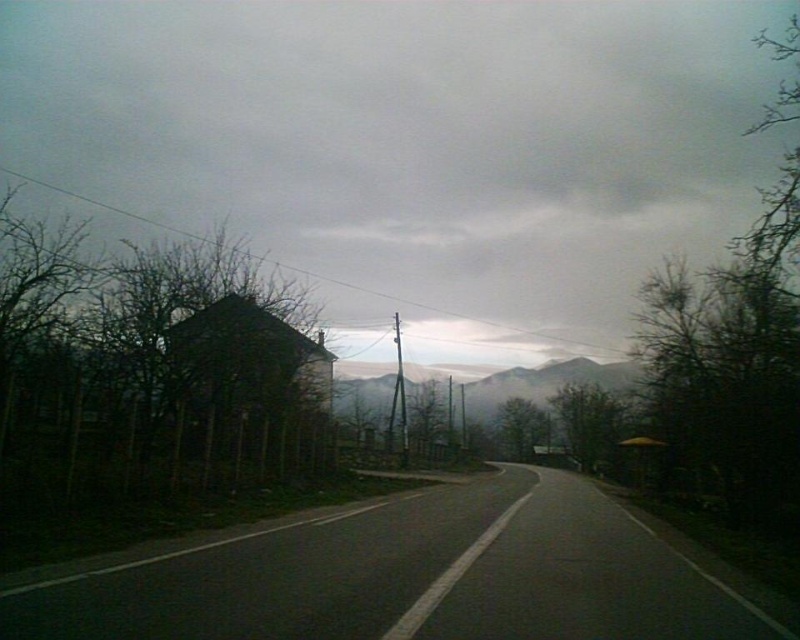
You are a hiker who wants to take a photo of the dark brown wooden hut at center and the foggy misty mountains at center. Which one is closer to you in the scene?

The dark brown wooden hut at center is closer to you because it is positioned in front of the foggy misty mountains at center.

Looking at this image, you are standing at the starting point of the road and want to reach the dark brown wooden hut at center. Which direction should you head towards?

You should head towards the center of the road to reach the dark brown wooden hut at center, as it is located at point (252, 390).

You are driving along the black asphalt road at center and want to take a photo of the foggy misty mountains at center. Since the mountains are in the background, where should you position your camera relative to the road to capture them clearly?

The black asphalt road at center is in front of the foggy misty mountains at center, so to capture the mountains clearly in the background, position your camera behind the road so it doesn t block the view of the mountains.